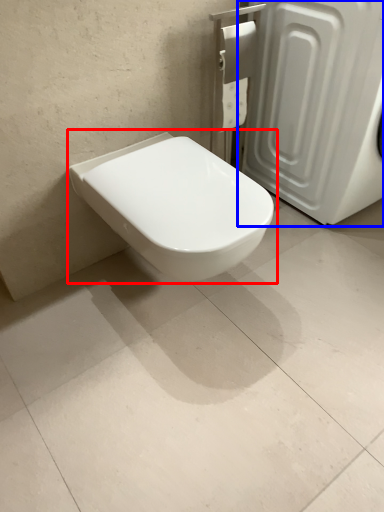
Question: Which of the following is the closest to the observer, toilet (highlighted by a red box) or screen door (highlighted by a blue box)?

Choices:
 (A) toilet
 (B) screen door

Answer: (A)